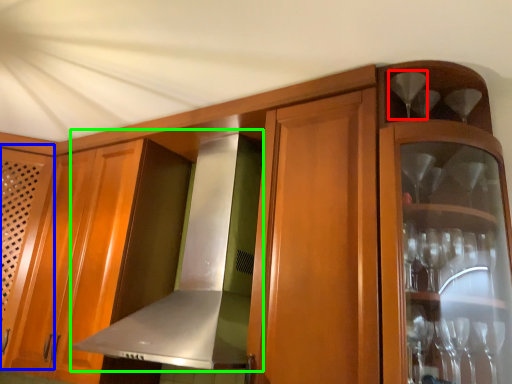
Question: Based on their relative distances, which object is nearer to wine glass (highlighted by a red box)? Choose from door (highlighted by a blue box) and exhaust hood (highlighted by a green box).

Choices:
 (A) door
 (B) exhaust hood

Answer: (B)